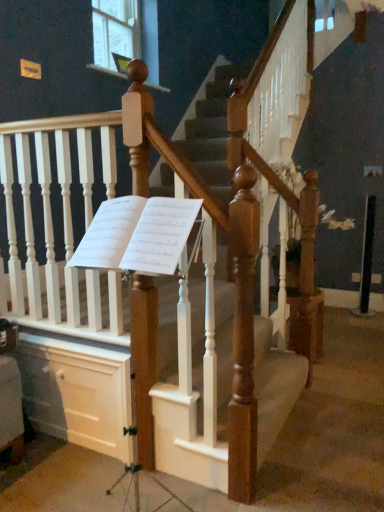
What do you see at coordinates (137, 234) in the screenshot? I see `white paper sheet music at center` at bounding box center [137, 234].

At what (x,y) coordinates should I click in order to perform the action: click on clear glass window at upper center. Please return your answer as a coordinate pair (x, y). This screenshot has width=384, height=512. Looking at the image, I should click on (126, 37).

The image size is (384, 512). I want to click on white paper sheet music at center, so click(x=137, y=234).

Considering the points (193, 384) and (127, 388), which point is behind, point (193, 384) or point (127, 388)?

The point (193, 384) is more distant.

Consider the image. Is wooden staircase at center smaller than white painted wood drawer at lower left?

Incorrect, wooden staircase at center is not smaller in size than white painted wood drawer at lower left.

From the image's perspective, would you say wooden staircase at center is positioned over white painted wood drawer at lower left?

No.

Is wooden staircase at center far away from white painted wood drawer at lower left?

No, there isn't a large distance between wooden staircase at center and white painted wood drawer at lower left.

Considering the sizes of objects white painted wood drawer at lower left and wooden staircase at center in the image provided, who is wider, white painted wood drawer at lower left or wooden staircase at center?

wooden staircase at center.

What's the angular difference between white painted wood drawer at lower left and wooden staircase at center's facing directions?

They differ by 0.778 degrees in their facing directions.

From the image's perspective, between white painted wood drawer at lower left and wooden staircase at center, who is located below?

wooden staircase at center, from the image's perspective.

Does white painted wood drawer at lower left come behind wooden staircase at center?

Yes.

Which object is further away from the camera taking this photo, white paper sheet music at center or wooden staircase at center?

white paper sheet music at center.

Is white paper sheet music at center inside or outside of wooden staircase at center?

white paper sheet music at center is not inside wooden staircase at center, it's outside.

Considering the sizes of white paper sheet music at center and wooden staircase at center in the image, is white paper sheet music at center taller or shorter than wooden staircase at center?

Clearly, white paper sheet music at center is taller compared to wooden staircase at center.

Can you see white paper sheet music at center touching white painted wood drawer at lower left?

They are not placed beside each other.

From the image's perspective, is white paper sheet music at center on white painted wood drawer at lower left?

Yes, from the image's perspective, white paper sheet music at center is above white painted wood drawer at lower left.

Considering the sizes of objects white paper sheet music at center and white painted wood drawer at lower left in the image provided, who is shorter, white paper sheet music at center or white painted wood drawer at lower left?

With less height is white paper sheet music at center.

Does white paper sheet music at center turn towards white painted wood drawer at lower left?

No, white paper sheet music at center is not turned towards white painted wood drawer at lower left.

Can you confirm if white painted wood drawer at lower left is shorter than clear glass window at upper center?

Correct, white painted wood drawer at lower left is not as tall as clear glass window at upper center.

Where is `drawer on the left of clear glass window at upper center`? This screenshot has height=512, width=384. drawer on the left of clear glass window at upper center is located at coordinates (77, 393).

Based on the photo, which is in front, white painted wood drawer at lower left or clear glass window at upper center?

Positioned in front is white painted wood drawer at lower left.

Measure the distance from white painted wood drawer at lower left to clear glass window at upper center.

7.34 feet.

Between white paper sheet music at center and clear glass window at upper center, which one has more height?

clear glass window at upper center is taller.

Choose the correct answer: Is white paper sheet music at center inside clear glass window at upper center or outside it?

white paper sheet music at center is not enclosed by clear glass window at upper center.

Does white paper sheet music at center appear on the left side of clear glass window at upper center?

No, white paper sheet music at center is not to the left of clear glass window at upper center.

Does white paper sheet music at center turn towards clear glass window at upper center?

No, white paper sheet music at center is not facing towards clear glass window at upper center.

What's the angular difference between white painted wood drawer at lower left and white paper sheet music at center's facing directions?

The angle between the facing direction of white painted wood drawer at lower left and the facing direction of white paper sheet music at center is 4.95 degrees.

Based on their sizes in the image, would you say white painted wood drawer at lower left is bigger or smaller than white paper sheet music at center?

Clearly, white painted wood drawer at lower left is smaller in size than white paper sheet music at center.

Considering the positions of objects white painted wood drawer at lower left and white paper sheet music at center in the image provided, who is more to the left, white painted wood drawer at lower left or white paper sheet music at center?

white painted wood drawer at lower left.

From the image's perspective, does white painted wood drawer at lower left appear higher than white paper sheet music at center?

Incorrect, from the image's perspective, white painted wood drawer at lower left is lower than white paper sheet music at center.

Where is `stairs directly beneath the white painted wood drawer at lower left (from a real-world perspective)`? stairs directly beneath the white painted wood drawer at lower left (from a real-world perspective) is located at coordinates [77, 389].

Where is `stairs that appears in front of the white painted wood drawer at lower left`? stairs that appears in front of the white painted wood drawer at lower left is located at coordinates (77, 389).

Which object lies nearer to the anchor point clear glass window at upper center, wooden staircase at center or white paper sheet music at center?

Based on the image, white paper sheet music at center appears to be nearer to clear glass window at upper center.

Looking at the image, which one is located further to wooden staircase at center, white painted wood drawer at lower left or white paper sheet music at center?

white paper sheet music at center is further to wooden staircase at center.

Based on their spatial positions, is clear glass window at upper center or white paper sheet music at center closer to white painted wood drawer at lower left?

The object closer to white painted wood drawer at lower left is white paper sheet music at center.

When comparing their distances from white painted wood drawer at lower left, does clear glass window at upper center or wooden staircase at center seem closer?

wooden staircase at center is positioned closer to the anchor white painted wood drawer at lower left.

Which object lies nearer to the anchor point wooden staircase at center, white paper sheet music at center or clear glass window at upper center?

white paper sheet music at center is positioned closer to the anchor wooden staircase at center.

From the image, which object appears to be farther from wooden staircase at center, white paper sheet music at center or white painted wood drawer at lower left?

white paper sheet music at center is further to wooden staircase at center.

Estimate the real-world distances between objects in this image. Which object is further from clear glass window at upper center, white painted wood drawer at lower left or wooden staircase at center?

Based on the image, white painted wood drawer at lower left appears to be further to clear glass window at upper center.

Looking at the image, which one is located closer to white painted wood drawer at lower left, wooden staircase at center or clear glass window at upper center?

wooden staircase at center is positioned closer to the anchor white painted wood drawer at lower left.

You are a GUI agent. You are given a task and a screenshot of the screen. Output one action in this format:
    pyautogui.click(x=<x>, y=<y>)
    Task: Click on the sheet music between clear glass window at upper center and white painted wood drawer at lower left in the vertical direction
    
    Given the screenshot: What is the action you would take?
    pyautogui.click(x=137, y=234)

Identify the location of sheet music between white painted wood drawer at lower left and wooden staircase at center. This screenshot has width=384, height=512. (137, 234).

Where is `sheet music between clear glass window at upper center and wooden staircase at center from top to bottom`? sheet music between clear glass window at upper center and wooden staircase at center from top to bottom is located at coordinates (137, 234).

Image resolution: width=384 pixels, height=512 pixels. Find the location of `drawer between clear glass window at upper center and wooden staircase at center from top to bottom`. drawer between clear glass window at upper center and wooden staircase at center from top to bottom is located at coordinates (77, 393).